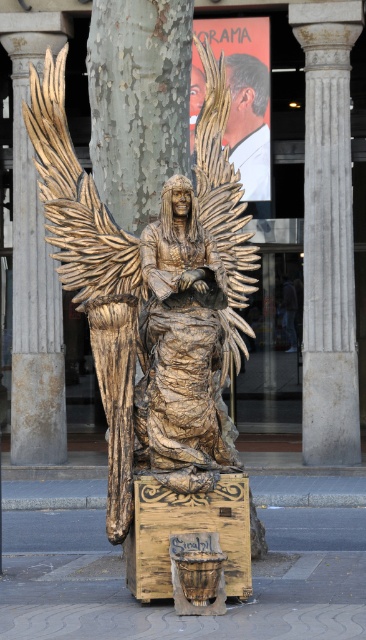
Question: Which point is farther to the camera?

Choices:
 (A) (46, 307)
 (B) (247, 132)
 (C) (319, 141)

Answer: (B)

Question: Does white marble column at center have a lesser width compared to smooth marble pillar at center?

Choices:
 (A) no
 (B) yes

Answer: (B)

Question: Estimate the real-world distances between objects in this image. Which object is farther from the smooth marble pillar at center?

Choices:
 (A) wooden statue at center
 (B) smooth skin at upper center

Answer: (A)

Question: From the image, what is the correct spatial relationship of white marble column at center in relation to smooth marble pillar at center?

Choices:
 (A) right
 (B) left

Answer: (A)

Question: Among these points, which one is nearest to the camera?

Choices:
 (A) (157, 458)
 (B) (21, 77)
 (C) (310, 67)
 (D) (258, 115)

Answer: (A)

Question: Does white marble column at center lie behind smooth skin at upper center?

Choices:
 (A) yes
 (B) no

Answer: (B)